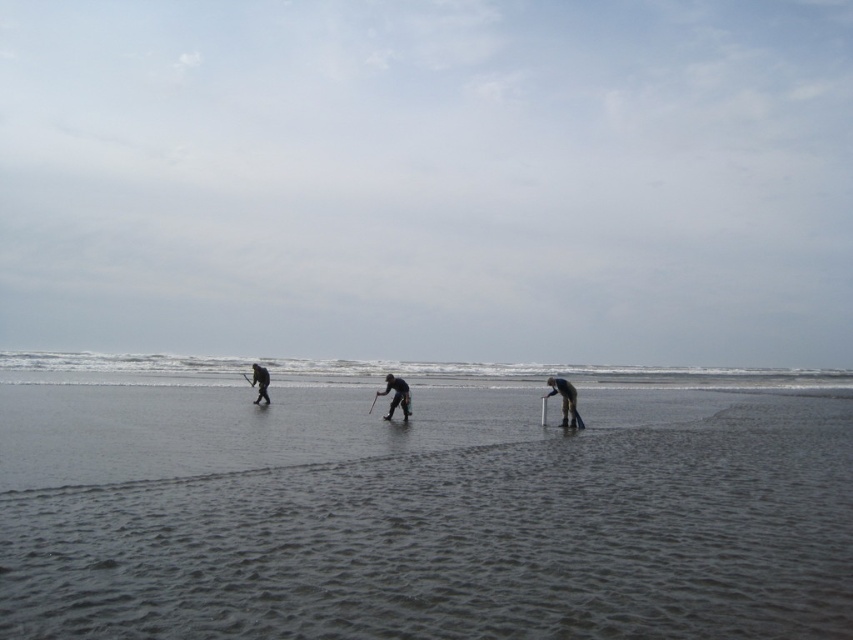
What are the coordinates of the smooth sand beach at center?

Result: The smooth sand beach at center is located at coordinates point (422, 515).

You are standing on the beach and see the smooth sand beach at center and the dark gray fabric pants at center. Which object is closer to the ground?

The smooth sand beach at center is located below dark gray fabric pants at center, so it is closer to the ground.

What is the color of the pants at the location specified by point coordinates (396, 396)?

The point at coordinates (396, 396) is on dark gray fabric pants at center.